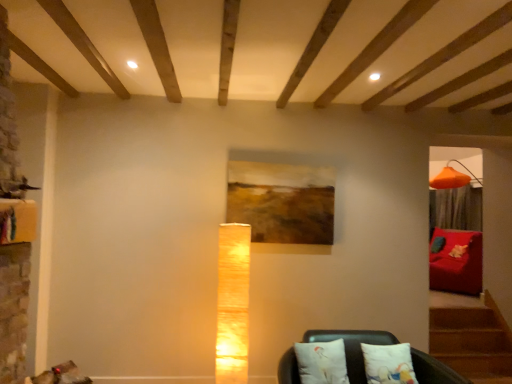
Question: Considering their positions, is white cotton pillow at lower center, the 2th pillow from the left, located in front of or behind velvet red sofa at right, marked as the 2th furniture in a left-to-right arrangement?

Choices:
 (A) front
 (B) behind

Answer: (A)

Question: Based on their positions, is white cotton pillow at lower center, the 2th pillow from the left, located to the left or right of velvet red sofa at right, which is counted as the first furniture, starting from the right?

Choices:
 (A) left
 (B) right

Answer: (A)

Question: Which object is positioned farthest from the white fabric cushions at lower center, which ranks as the 2th furniture in right-to-left order?

Choices:
 (A) velvet red sofa at right, which ranks as the first furniture in back-to-front order
 (B) matte textured lamp at center
 (C) white fabric pillow at lower center, positioned as the first pillow in left-to-right order
 (D) wooden painting at center
 (E) white cotton pillow at lower center, the first pillow when ordered from right to left

Answer: (A)

Question: Which object is positioned farthest from the white cotton pillow at lower center, the 2th pillow from the left?

Choices:
 (A) velvet red sofa at right, the second furniture in the front-to-back sequence
 (B) matte textured lamp at center
 (C) wooden painting at center
 (D) white fabric cushions at lower center, which ranks as the 2th furniture in right-to-left order
 (E) white fabric pillow at lower center, positioned as the first pillow in left-to-right order

Answer: (A)